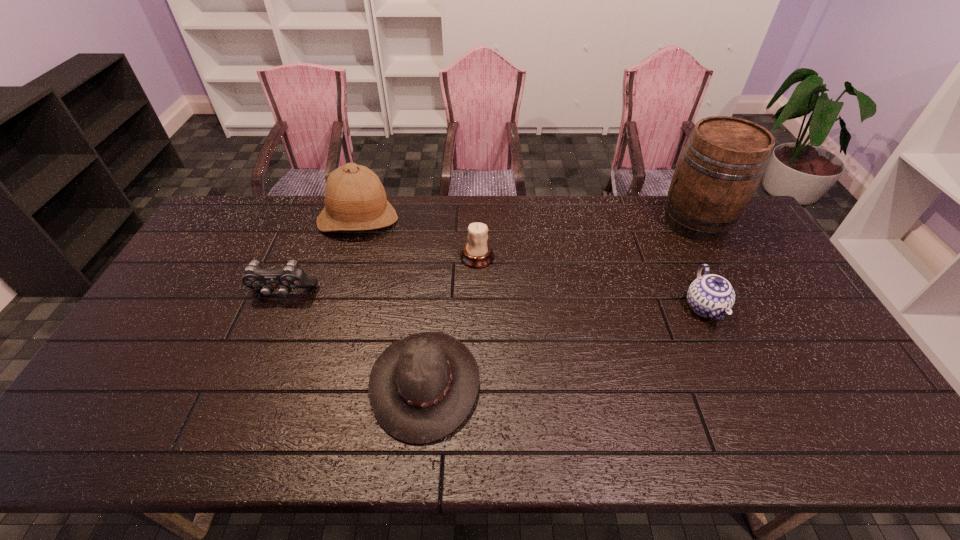
Where is `object present at the far right corner`? The image size is (960, 540). object present at the far right corner is located at coordinates (722, 163).

You are a GUI agent. You are given a task and a screenshot of the screen. Output one action in this format:
    pyautogui.click(x=<x>, y=<y>)
    Task: Click on the free space at the far edge of the desktop
    
    Given the screenshot: What is the action you would take?
    coord(352,232)

You are a GUI agent. You are given a task and a screenshot of the screen. Output one action in this format:
    pyautogui.click(x=<x>, y=<y>)
    Task: Click on the vacant space at the left edge of the desktop
    Image resolution: width=960 pixels, height=540 pixels.
    Given the screenshot: What is the action you would take?
    pyautogui.click(x=158, y=340)

Find the location of a particular element. This screenshot has height=540, width=960. vacant space at the right edge of the desktop is located at coordinates (804, 366).

In the image, there is a desktop. What are the coordinates of `vacant region at the far left corner` in the screenshot? It's located at (233, 200).

Locate an element on the screen. Image resolution: width=960 pixels, height=540 pixels. free space at the near left corner of the desktop is located at coordinates (122, 430).

The width and height of the screenshot is (960, 540). What are the coordinates of `free space between the shorter hat and the chinaware` in the screenshot? It's located at (564, 345).

Find the location of a particular element. The width and height of the screenshot is (960, 540). empty space that is in between the cider and the nearer hat is located at coordinates (561, 302).

Locate an element on the screen. This screenshot has width=960, height=540. free space between the candle holder and the chinaware is located at coordinates (590, 282).

Identify the location of free point between the chinaware and the candle holder. (590, 282).